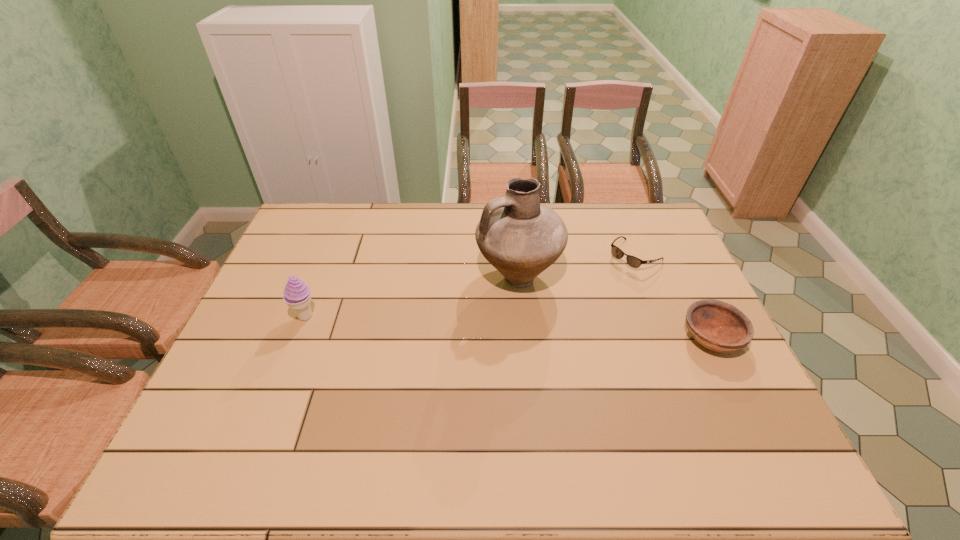
The width and height of the screenshot is (960, 540). I want to click on free spot on the desktop that is between the icecream and the third tallest object and is positioned on the front-facing side of the shortest object, so click(x=544, y=329).

Find the location of `vacant space on the desktop that is between the leftmost object and the bowl and is positioned on the handle side of the third object from right to left`. vacant space on the desktop that is between the leftmost object and the bowl and is positioned on the handle side of the third object from right to left is located at coordinates (445, 323).